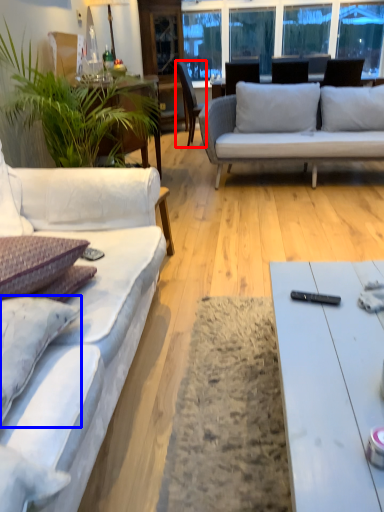
Question: Which object appears closest to the camera in this image, chair (highlighted by a red box) or pillow (highlighted by a blue box)?

Choices:
 (A) chair
 (B) pillow

Answer: (B)